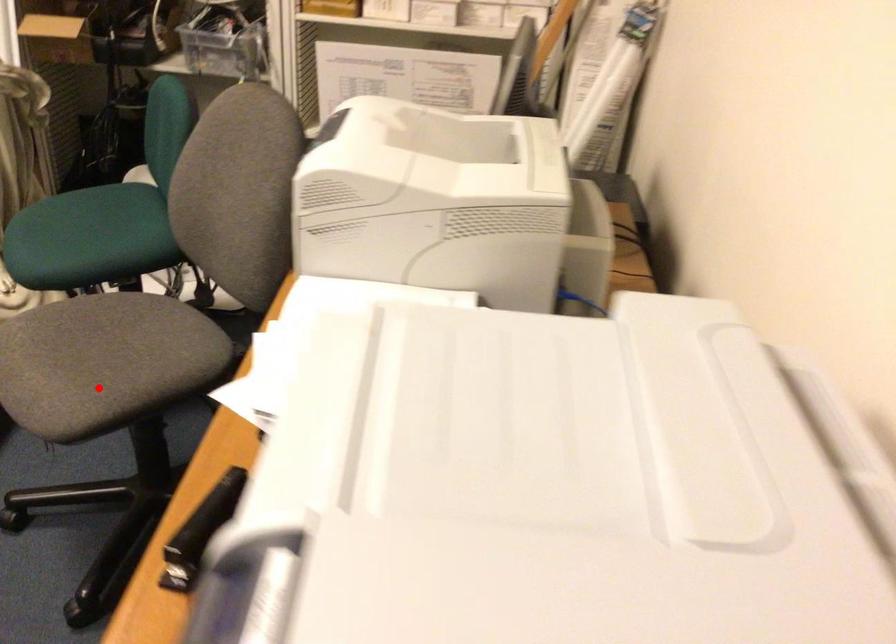
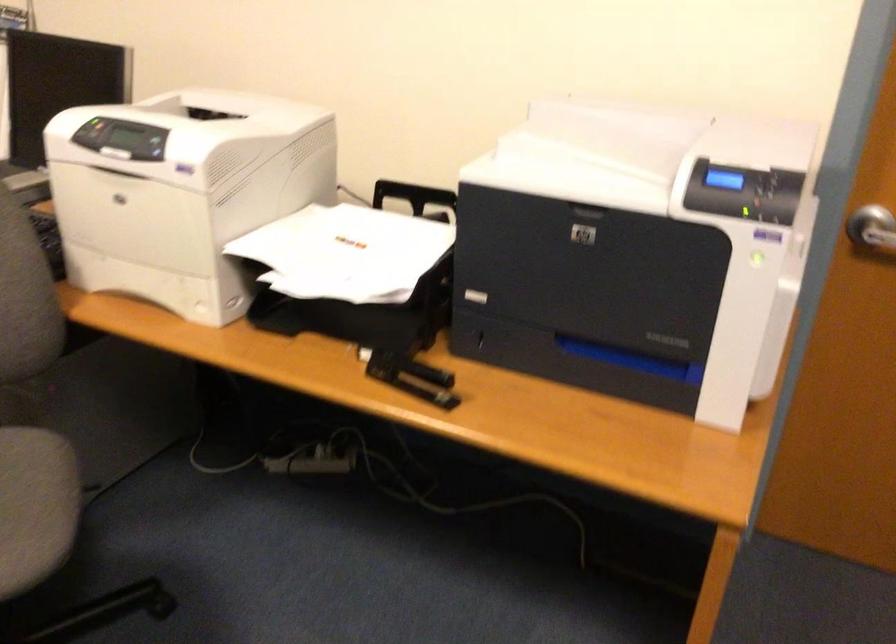
Locate, in the second image, the point that corresponds to the highlighted location in the first image.

(35, 506)